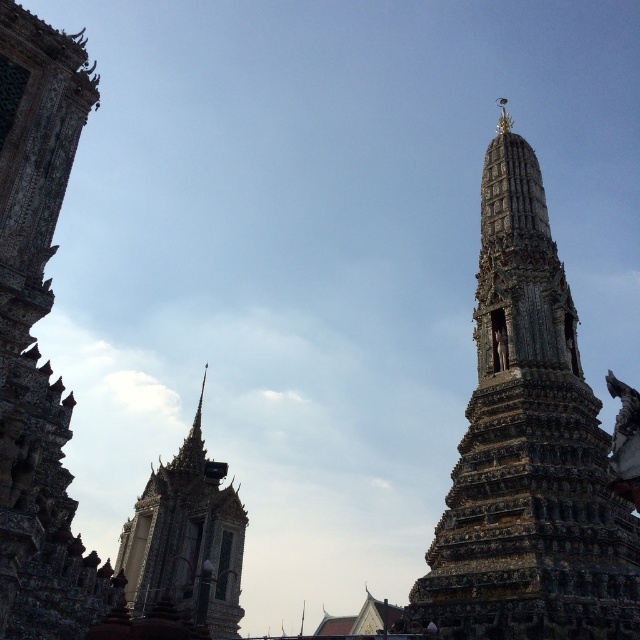
Question: Which of the following is the closest to the observer?

Choices:
 (A) carved stone temple at left
 (B) carved stone stupa at right
 (C) shiny gold spire at upper left

Answer: (A)

Question: Where is carved stone stupa at right located in relation to carved stone temple at left in the image?

Choices:
 (A) above
 (B) below

Answer: (A)

Question: Based on their relative distances, which object is farther from the carved stone stupa at right?

Choices:
 (A) shiny gold spire at upper left
 (B) carved stone temple at left

Answer: (A)

Question: Can you confirm if carved stone stupa at right is thinner than shiny gold spire at upper left?

Choices:
 (A) no
 (B) yes

Answer: (B)

Question: Which point appears farthest from the camera in this image?

Choices:
 (A) (198, 401)
 (B) (56, 611)
 (C) (460, 579)

Answer: (A)

Question: From the image, what is the correct spatial relationship of carved stone stupa at right in relation to carved stone temple at left?

Choices:
 (A) left
 (B) right

Answer: (B)